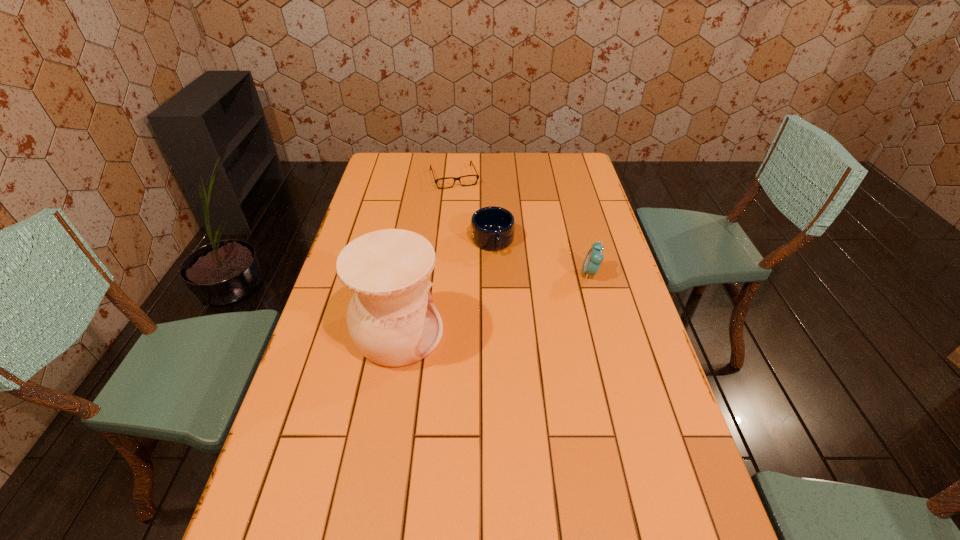
Locate an element on the screen. Image resolution: width=960 pixels, height=540 pixels. vacant point located between the shortest object and the second farthest object is located at coordinates (473, 209).

Find the location of a particular element. The width and height of the screenshot is (960, 540). unoccupied area between the second shortest object and the third shortest object is located at coordinates (541, 258).

The height and width of the screenshot is (540, 960). Find the location of `empty location between the nearest object and the alarm clock`. empty location between the nearest object and the alarm clock is located at coordinates (494, 303).

At what (x,y) coordinates should I click in order to perform the action: click on vacant area between the second farthest object and the alarm clock. Please return your answer as a coordinate pair (x, y). Looking at the image, I should click on (541, 258).

Locate an element on the screen. The height and width of the screenshot is (540, 960). vacant area that lies between the tallest object and the mug is located at coordinates (445, 287).

Find the location of a particular element. The image size is (960, 540). free space between the pottery and the second farthest object is located at coordinates (445, 287).

Find the location of a particular element. Image resolution: width=960 pixels, height=540 pixels. blank region between the rightmost object and the pottery is located at coordinates (494, 303).

I want to click on vacant space that's between the spectacles and the rightmost object, so click(x=522, y=225).

The image size is (960, 540). In order to click on the closest object to the farthest object in this screenshot , I will do `click(492, 228)`.

Choose which object is the third nearest neighbor to the nearest object. Please provide its 2D coordinates. Your answer should be formatted as a tuple, i.e. [(x, y)], where the tuple contains the x and y coordinates of a point satisfying the conditions above.

[(477, 176)]